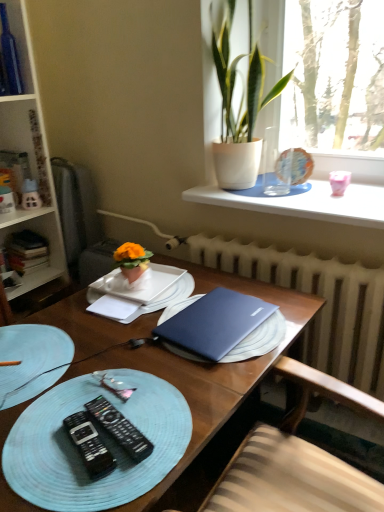
Question: From a real-world perspective, is black plastic remote control at lower left, acting as the second remote control starting from the right, on top of blue glass bottle at upper left?

Choices:
 (A) no
 (B) yes

Answer: (A)

Question: Can you see black plastic remote control at lower left, positioned as the 1th remote control in left-to-right order, touching blue glass bottle at upper left?

Choices:
 (A) yes
 (B) no

Answer: (B)

Question: Is black plastic remote control at lower left, acting as the second remote control starting from the right, located outside blue glass bottle at upper left?

Choices:
 (A) yes
 (B) no

Answer: (A)

Question: Is black plastic remote control at lower left, acting as the second remote control starting from the right, facing away from blue glass bottle at upper left?

Choices:
 (A) yes
 (B) no

Answer: (B)

Question: Considering the relative sizes of black plastic remote control at lower left, acting as the second remote control starting from the right, and blue glass bottle at upper left in the image provided, is black plastic remote control at lower left, acting as the second remote control starting from the right, thinner than blue glass bottle at upper left?

Choices:
 (A) no
 (B) yes

Answer: (B)

Question: Is black plastic remote control at lower left, positioned as the 1th remote control in left-to-right order, behind blue glass bottle at upper left?

Choices:
 (A) yes
 (B) no

Answer: (B)

Question: Is satin blue laptop at center aimed at blue matte laptop at center?

Choices:
 (A) yes
 (B) no

Answer: (A)

Question: Is satin blue laptop at center positioned beyond the bounds of blue matte laptop at center?

Choices:
 (A) yes
 (B) no

Answer: (B)

Question: Considering the relative sizes of satin blue laptop at center and blue matte laptop at center in the image provided, is satin blue laptop at center bigger than blue matte laptop at center?

Choices:
 (A) no
 (B) yes

Answer: (A)

Question: Does satin blue laptop at center have a smaller size compared to blue matte laptop at center?

Choices:
 (A) no
 (B) yes

Answer: (B)

Question: From the image's perspective, does satin blue laptop at center appear lower than blue matte laptop at center?

Choices:
 (A) no
 (B) yes

Answer: (A)

Question: Can you see satin blue laptop at center touching blue matte laptop at center?

Choices:
 (A) yes
 (B) no

Answer: (B)

Question: Is green leafy plant at upper right, arranged as the 1th houseplant when viewed from the top, placed right next to blue matte laptop at center?

Choices:
 (A) yes
 (B) no

Answer: (B)